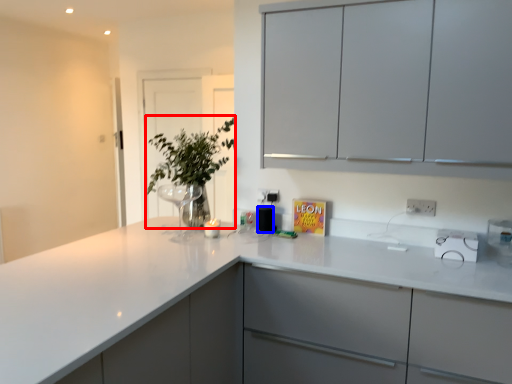
Question: Among these objects, which one is farthest to the camera, plant (highlighted by a red box) or appliance (highlighted by a blue box)?

Choices:
 (A) plant
 (B) appliance

Answer: (B)